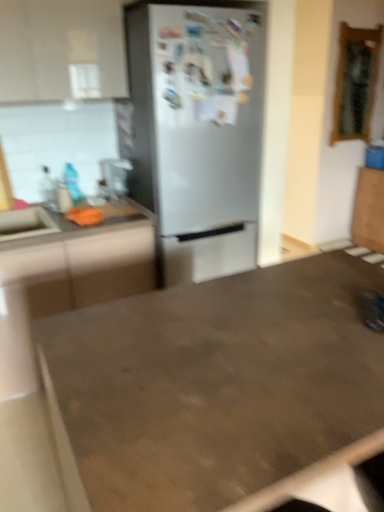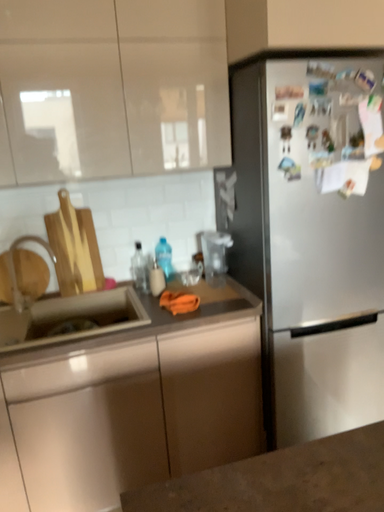
Question: How did the camera likely rotate when shooting the video?

Choices:
 (A) rotated left
 (B) rotated right

Answer: (A)